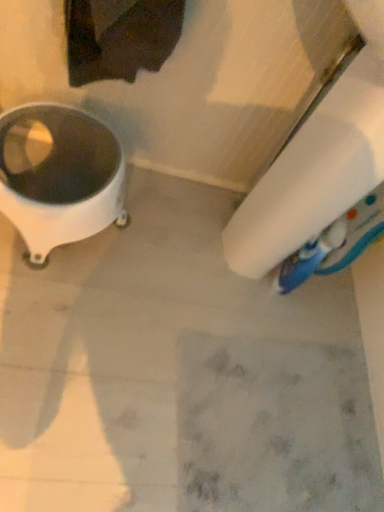
Locate an element on the screen. The width and height of the screenshot is (384, 512). free spot below white glossy toilet paper at lower right (from a real-world perspective) is located at coordinates (220, 252).